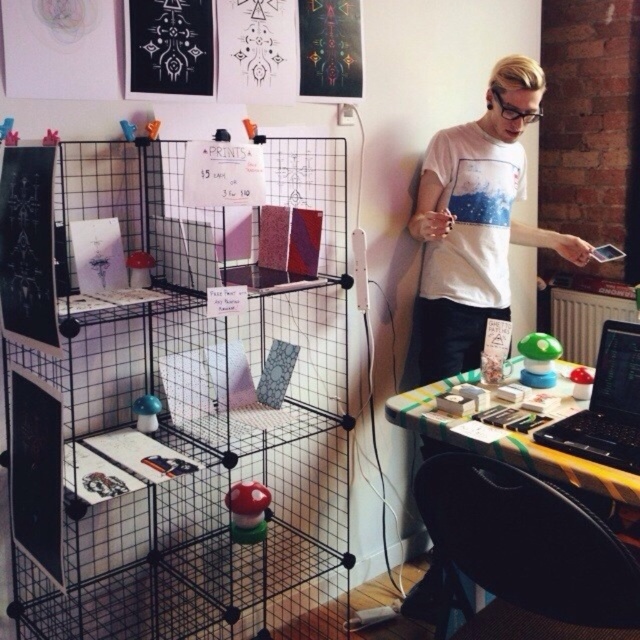
You are organizing a small event in this space and need to place a decorative item on the yellow checkered table at lower right. Which object from the scene can you place there without blocking the black wire mesh cage at center?

The black wire mesh cage at center is located below the yellow checkered table at lower right, so placing a decorative item on the yellow checkered table at lower right won